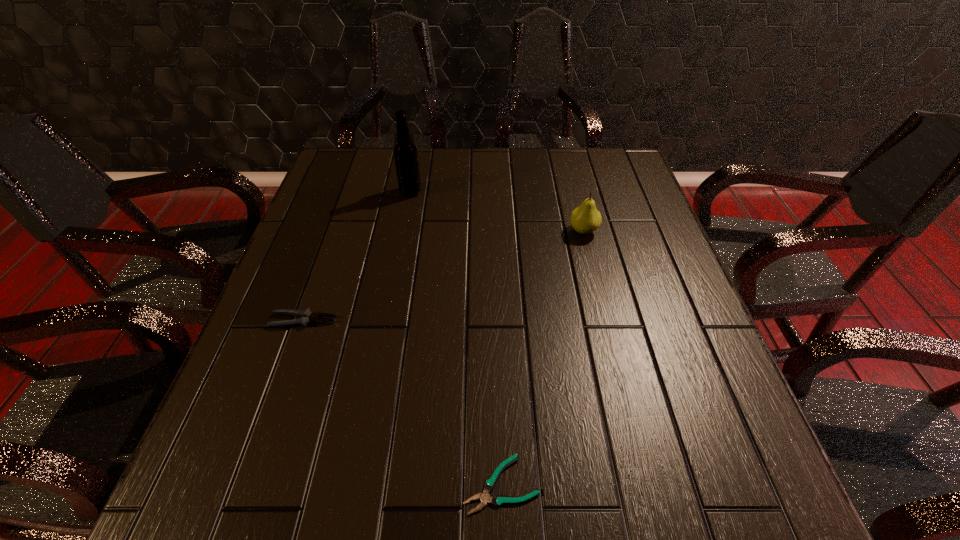
Locate an element on the screen. The image size is (960, 540). vacant point located at the gripping part of the farther pliers is located at coordinates (481, 320).

The width and height of the screenshot is (960, 540). Identify the location of vacant space located on the right of the shorter pliers. (613, 484).

Where is `object located at the far edge`? object located at the far edge is located at coordinates (405, 153).

The image size is (960, 540). Find the location of `object at the near edge`. object at the near edge is located at coordinates (497, 500).

I want to click on object that is at the left edge, so click(x=307, y=317).

This screenshot has height=540, width=960. I want to click on object present at the right edge, so click(x=585, y=219).

This screenshot has width=960, height=540. In order to click on vacant position at the far edge of the desktop in this screenshot , I will do `click(563, 169)`.

Image resolution: width=960 pixels, height=540 pixels. I want to click on vacant area at the left edge, so click(324, 265).

This screenshot has width=960, height=540. In order to click on blank space at the right edge of the desktop in this screenshot , I will do `click(669, 285)`.

Where is `free space at the near left corner of the desktop`? This screenshot has height=540, width=960. free space at the near left corner of the desktop is located at coordinates (276, 512).